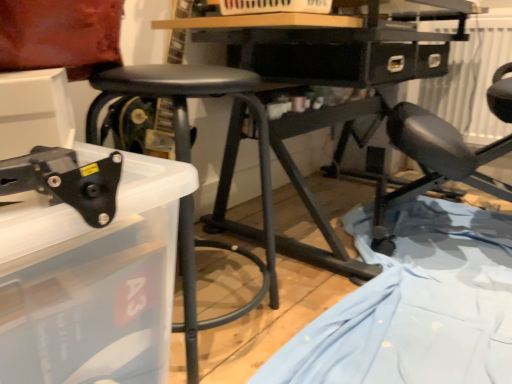
Question: From the image's perspective, relative to black plastic tool at lower left, is light blue fabric at lower right above or below?

Choices:
 (A) above
 (B) below

Answer: (B)

Question: From a real-world perspective, is light blue fabric at lower right physically located above or below black plastic tool at lower left?

Choices:
 (A) above
 (B) below

Answer: (B)

Question: Which object is the farthest from the matte black chair at right?

Choices:
 (A) light blue fabric at lower right
 (B) black matte stool at center
 (C) black plastic tool at lower left

Answer: (C)

Question: Considering the real-world distances, which object is closest to the light blue fabric at lower right?

Choices:
 (A) matte black chair at right
 (B) black plastic tool at lower left
 (C) black matte stool at center

Answer: (A)